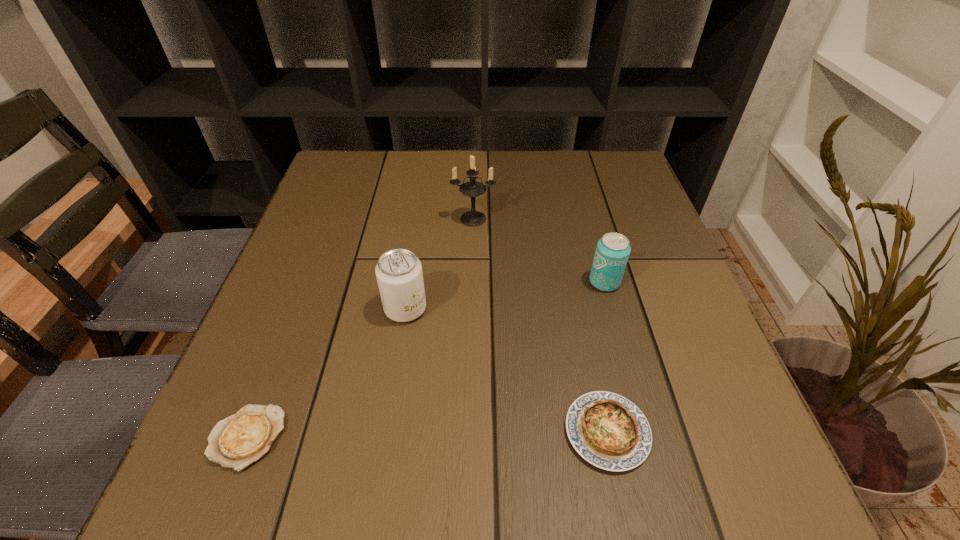
At what (x,y) coordinates should I click in order to perform the action: click on free region at the near edge of the desktop. Please return your answer as a coordinate pair (x, y). The width and height of the screenshot is (960, 540). Looking at the image, I should click on tap(572, 469).

You are a GUI agent. You are given a task and a screenshot of the screen. Output one action in this format:
    pyautogui.click(x=<x>, y=<y>)
    Task: Click on the vacant region at the left edge of the desktop
    
    Given the screenshot: What is the action you would take?
    pyautogui.click(x=325, y=295)

This screenshot has height=540, width=960. In the image, there is a desktop. In order to click on free space at the right edge in this screenshot , I will do `click(667, 249)`.

Where is `free space at the far left corner of the desktop`? Image resolution: width=960 pixels, height=540 pixels. free space at the far left corner of the desktop is located at coordinates (388, 164).

In the image, there is a desktop. At what (x,y) coordinates should I click in order to perform the action: click on blank space at the near left corner. Please return your answer as a coordinate pair (x, y). Looking at the image, I should click on (243, 487).

Image resolution: width=960 pixels, height=540 pixels. In order to click on vacant space at the far right corner in this screenshot , I will do `click(622, 152)`.

This screenshot has height=540, width=960. I want to click on free region at the near right corner, so click(695, 480).

Locate an element on the screen. The height and width of the screenshot is (540, 960). free space between the candle holder and the second shortest object is located at coordinates [540, 325].

Where is `blank region between the fourth nearest object and the leftmost object`? blank region between the fourth nearest object and the leftmost object is located at coordinates (426, 360).

Find the location of a particular element. This screenshot has height=540, width=960. free point between the left quiche and the fourth tallest object is located at coordinates (427, 435).